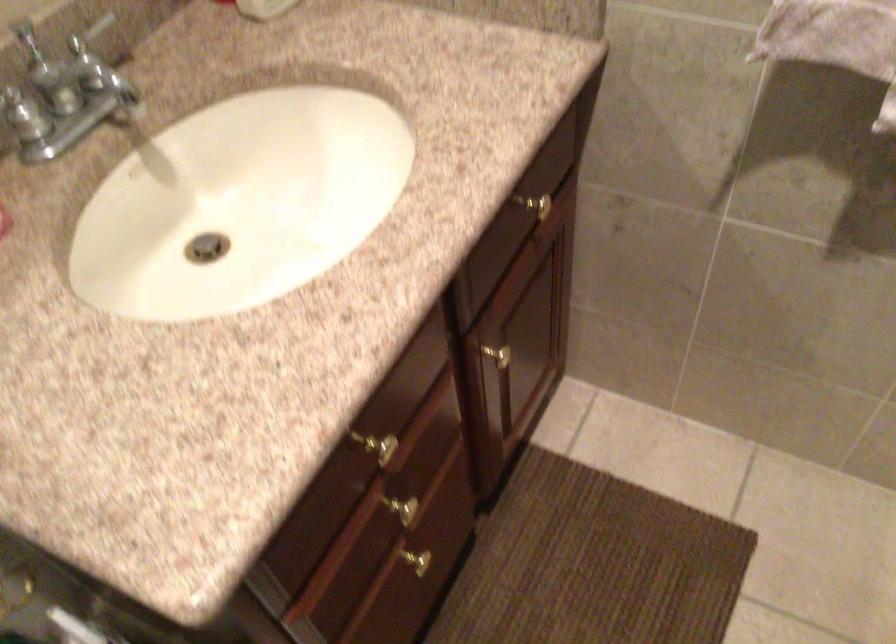
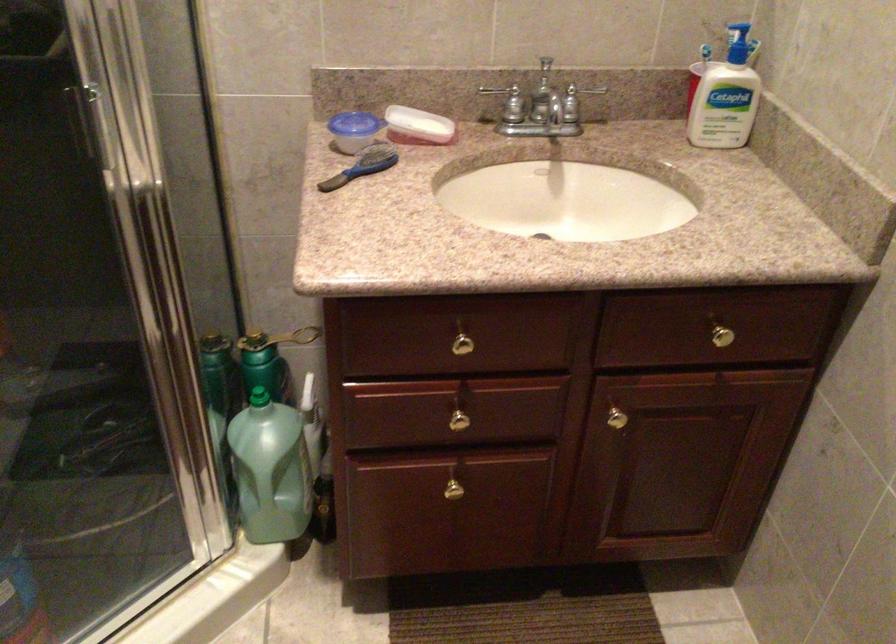
Where in the second image is the point corresponding to (418,560) from the first image?

(455, 488)